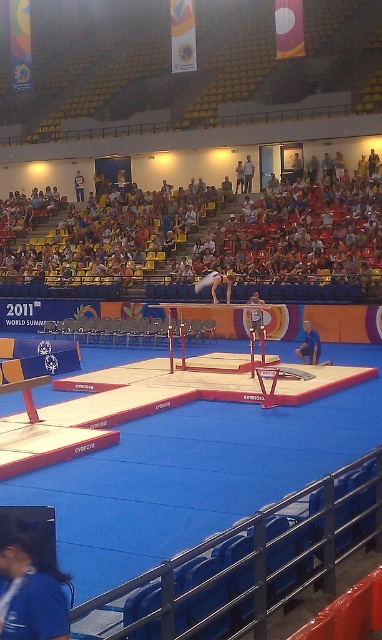
Question: In this image, where is multicolored fabric seats at upper center located relative to blue plastic barrier at lower right?

Choices:
 (A) left
 (B) right

Answer: (A)

Question: Which of the following is the closest to the observer?

Choices:
 (A) white fluffy gymnast at center
 (B) multicolored fabric seats at upper center

Answer: (A)

Question: Is multicolored fabric seats at upper center closer to the viewer compared to white fluffy gymnast at center?

Choices:
 (A) yes
 (B) no

Answer: (B)

Question: Which object appears farthest from the camera in this image?

Choices:
 (A) blue plastic barrier at lower right
 (B) multicolored fabric seats at upper center

Answer: (B)

Question: Is multicolored fabric seats at upper center positioned at the back of blue fabric at lower left?

Choices:
 (A) yes
 (B) no

Answer: (A)

Question: Considering the real-world distances, which object is closest to the white fluffy gymnast at center?

Choices:
 (A) blue plastic barrier at lower right
 (B) multicolored fabric seats at upper center
 (C) blue fabric at lower left
 (D) metallic red parallel bars at center

Answer: (D)